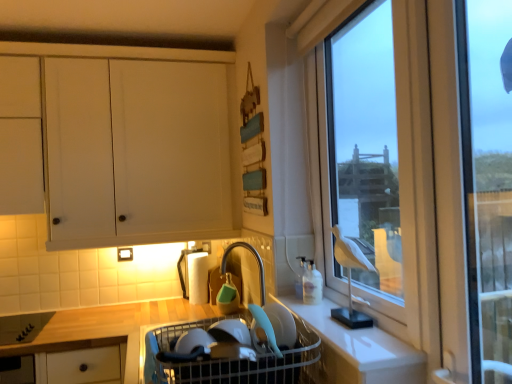
Identify the location of empty space that is ontop of white matte counter at lower right (from a real-world perspective). The image size is (512, 384). (331, 310).